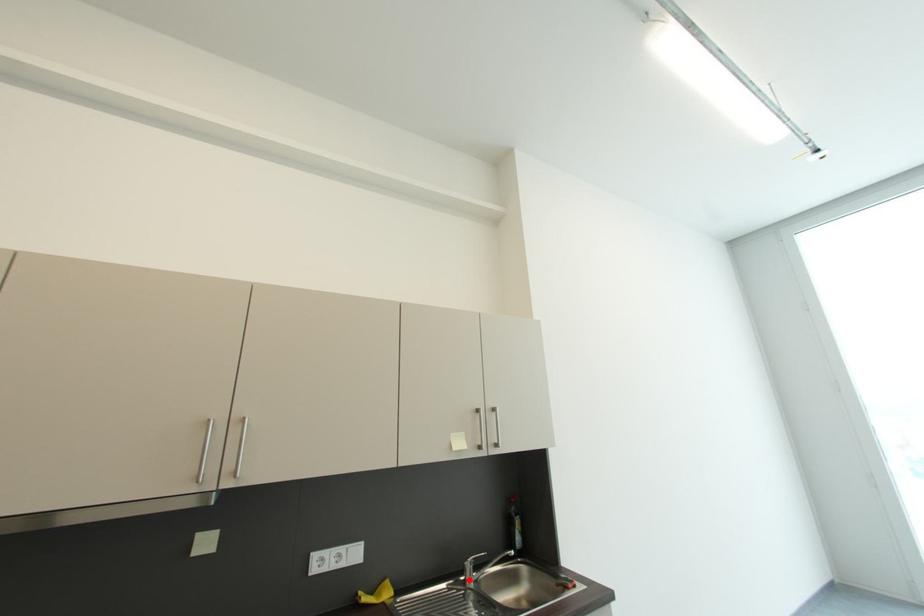
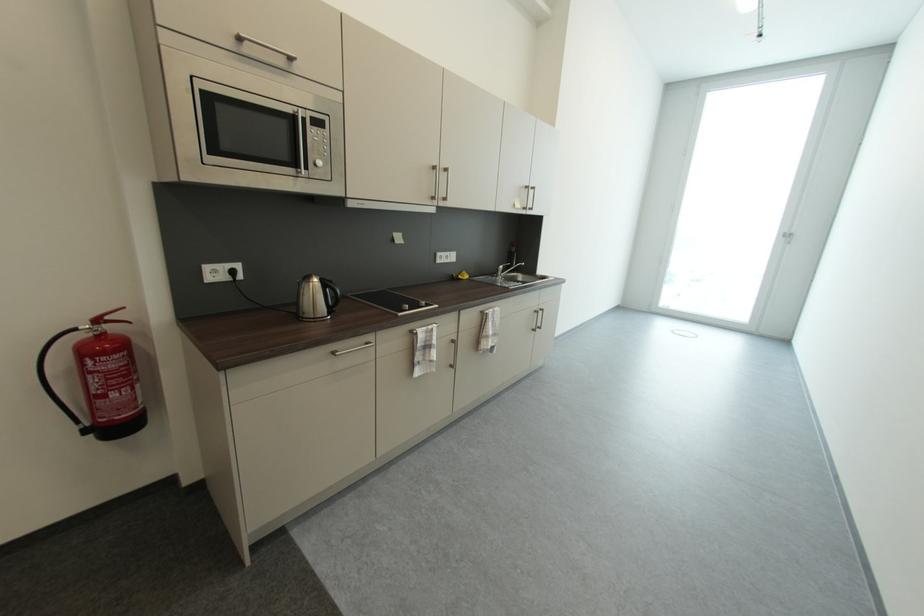
Locate, in the second image, the point that corresponds to the highlighted location in the first image.

(502, 277)